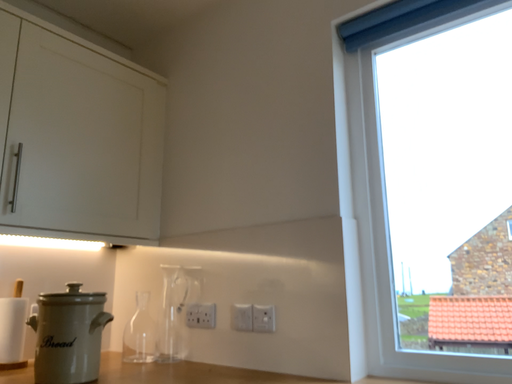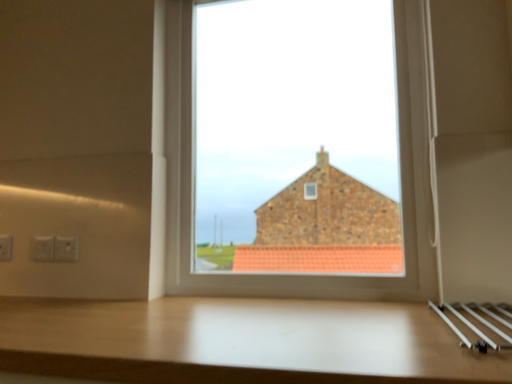
Question: Which way did the camera rotate in the video?

Choices:
 (A) rotated downward
 (B) rotated upward

Answer: (A)